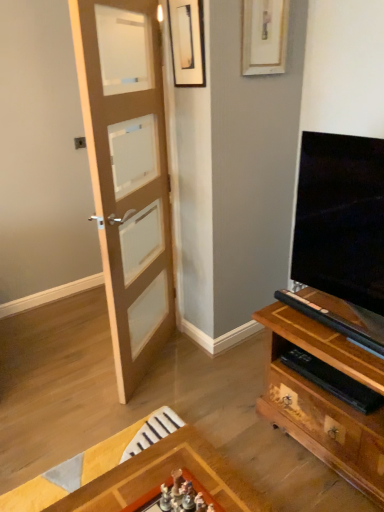
Question: Does matte black picture frame at upper center, the 1th picture frame in the left-to-right sequence, have a larger size compared to wooden picture frame at upper center, which appears as the 2th picture frame when viewed from the left?

Choices:
 (A) yes
 (B) no

Answer: (B)

Question: Can you confirm if matte black picture frame at upper center, the 1th picture frame in the left-to-right sequence, is positioned to the left of wooden picture frame at upper center, which appears as the 2th picture frame when viewed from the left?

Choices:
 (A) no
 (B) yes

Answer: (B)

Question: Is wooden picture frame at upper center, which appears as the 2th picture frame when viewed from the left, inside matte black picture frame at upper center, the 1th picture frame in the left-to-right sequence?

Choices:
 (A) no
 (B) yes

Answer: (A)

Question: Considering the relative sizes of matte black picture frame at upper center, the 2th picture frame when ordered from right to left, and wooden picture frame at upper center, the first picture frame when ordered from right to left, in the image provided, is matte black picture frame at upper center, the 2th picture frame when ordered from right to left, shorter than wooden picture frame at upper center, the first picture frame when ordered from right to left,?

Choices:
 (A) no
 (B) yes

Answer: (B)

Question: From a real-world perspective, is matte black picture frame at upper center, the 2th picture frame when ordered from right to left, located higher than wooden picture frame at upper center, which appears as the 2th picture frame when viewed from the left?

Choices:
 (A) yes
 (B) no

Answer: (B)

Question: Considering the positions of matte black picture frame at upper center, the 1th picture frame in the left-to-right sequence, and wooden picture frame at upper center, the first picture frame when ordered from right to left, in the image, is matte black picture frame at upper center, the 1th picture frame in the left-to-right sequence, wider or thinner than wooden picture frame at upper center, the first picture frame when ordered from right to left,?

Choices:
 (A) thin
 (B) wide

Answer: (B)

Question: Considering the positions of matte black picture frame at upper center, the 1th picture frame in the left-to-right sequence, and wooden picture frame at upper center, which appears as the 2th picture frame when viewed from the left, in the image, is matte black picture frame at upper center, the 1th picture frame in the left-to-right sequence, taller or shorter than wooden picture frame at upper center, which appears as the 2th picture frame when viewed from the left,?

Choices:
 (A) tall
 (B) short

Answer: (B)

Question: Considering their positions, is matte black picture frame at upper center, the 1th picture frame in the left-to-right sequence, located in front of or behind wooden picture frame at upper center, the first picture frame when ordered from right to left?

Choices:
 (A) front
 (B) behind

Answer: (A)

Question: Is matte black picture frame at upper center, the 2th picture frame when ordered from right to left, inside or outside of wooden picture frame at upper center, which appears as the 2th picture frame when viewed from the left?

Choices:
 (A) inside
 (B) outside

Answer: (B)

Question: Considering the positions of light brown wooden door at left and matte black picture frame at upper center, the 2th picture frame when ordered from right to left, in the image, is light brown wooden door at left taller or shorter than matte black picture frame at upper center, the 2th picture frame when ordered from right to left,?

Choices:
 (A) tall
 (B) short

Answer: (A)

Question: Considering the positions of light brown wooden door at left and matte black picture frame at upper center, the 2th picture frame when ordered from right to left, in the image, is light brown wooden door at left wider or thinner than matte black picture frame at upper center, the 2th picture frame when ordered from right to left,?

Choices:
 (A) thin
 (B) wide

Answer: (B)

Question: From the image's perspective, is light brown wooden door at left located above or below matte black picture frame at upper center, the 2th picture frame when ordered from right to left?

Choices:
 (A) below
 (B) above

Answer: (A)

Question: Looking at the image, does light brown wooden door at left seem bigger or smaller compared to matte black picture frame at upper center, the 2th picture frame when ordered from right to left?

Choices:
 (A) small
 (B) big

Answer: (B)

Question: Looking at the image, does matte black picture frame at upper center, the 1th picture frame in the left-to-right sequence, seem bigger or smaller compared to light brown wooden door at left?

Choices:
 (A) big
 (B) small

Answer: (B)

Question: Is point (178, 23) closer or farther from the camera than point (122, 50)?

Choices:
 (A) closer
 (B) farther

Answer: (B)